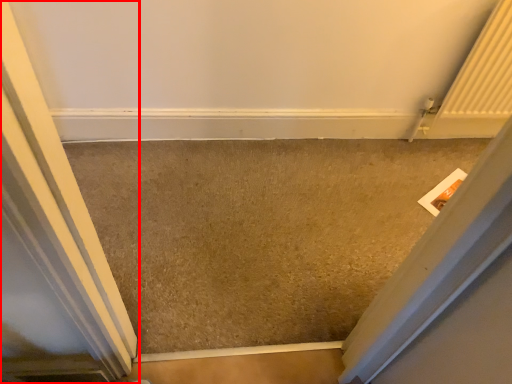
Question: From the image's perspective, what is the correct spatial positioning of door (annotated by the red box) in reference to concrete?

Choices:
 (A) below
 (B) above

Answer: (A)